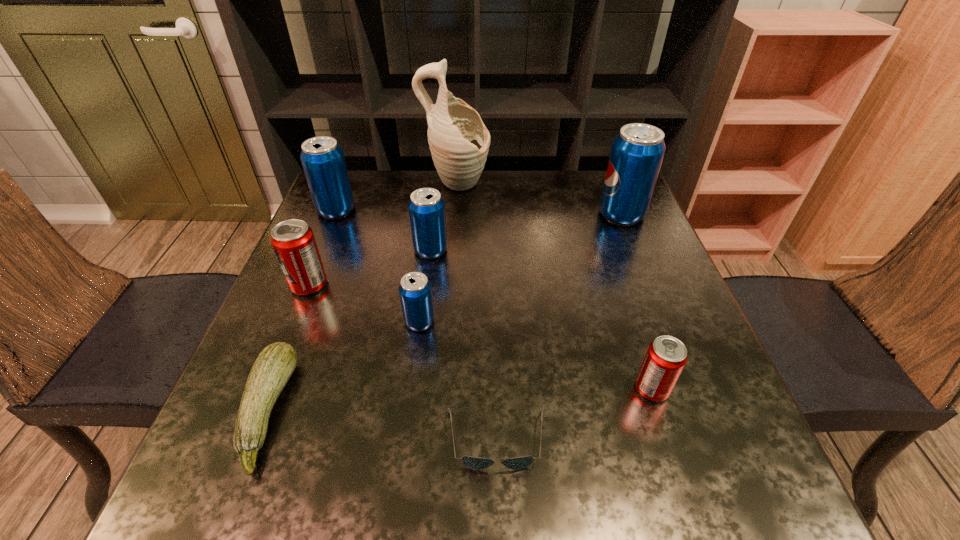
Identify the location of the tallest object. (459, 142).

Locate an element on the screen. The height and width of the screenshot is (540, 960). the biggest blue pop soda is located at coordinates (637, 152).

Identify the location of the rightmost blue pop soda. This screenshot has height=540, width=960. (637, 152).

The height and width of the screenshot is (540, 960). Find the location of `the seventh shortest object`. the seventh shortest object is located at coordinates (323, 161).

Where is `the leftmost blue pop soda`? This screenshot has width=960, height=540. the leftmost blue pop soda is located at coordinates (323, 161).

Find the location of a particular element. The height and width of the screenshot is (540, 960). the second smallest blue pop soda is located at coordinates (426, 207).

Identify the location of the third farthest blue pop soda. The height and width of the screenshot is (540, 960). (426, 207).

The height and width of the screenshot is (540, 960). Identify the location of the fourth farthest soda can. (293, 241).

I want to click on the left red soda can, so click(293, 241).

You are a GUI agent. You are given a task and a screenshot of the screen. Output one action in this format:
    pyautogui.click(x=<x>, y=<y>)
    Task: Click on the fifth farthest soda can
    The image size is (960, 540).
    Given the screenshot: What is the action you would take?
    pyautogui.click(x=415, y=292)